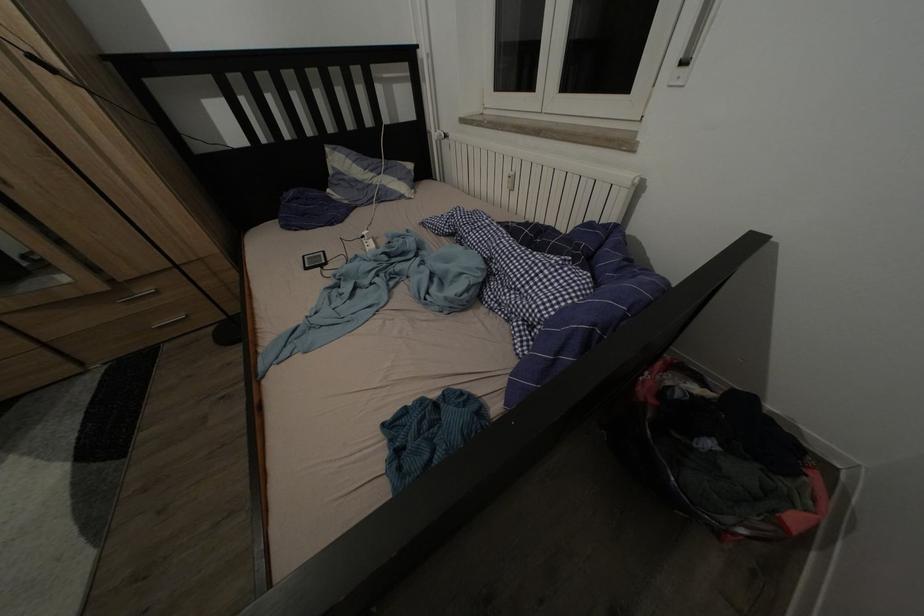
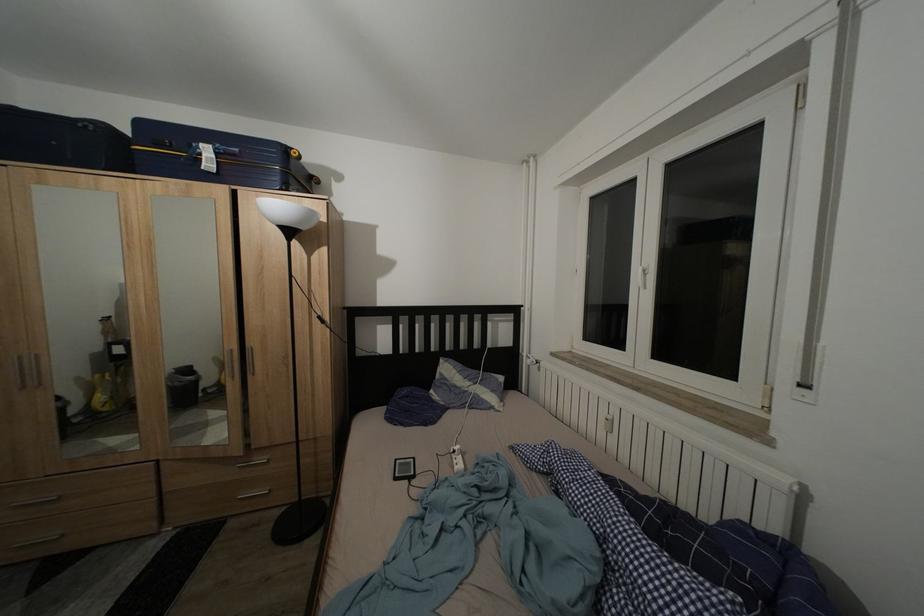
Based on the continuous images, in which direction is the camera rotating?

The camera rotated toward left-up.